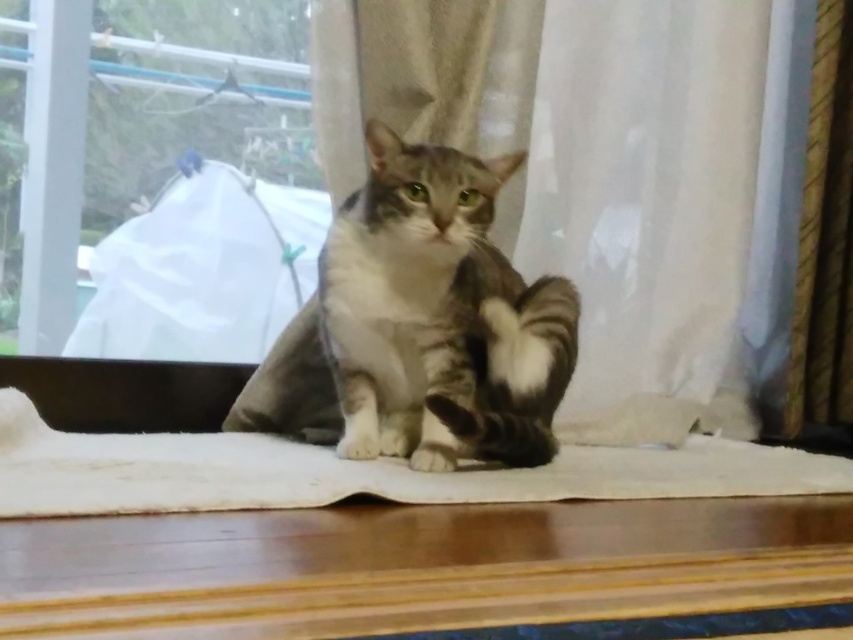
Question: Can you confirm if transparent plastic bag at left is thinner than white fabric mat at center?

Choices:
 (A) no
 (B) yes

Answer: (B)

Question: Which point appears closest to the camera in this image?

Choices:
 (A) (357, 378)
 (B) (45, 486)
 (C) (229, 136)
 (D) (682, 204)

Answer: (B)

Question: Among these objects, which one is farthest from the camera?

Choices:
 (A) gray tabby cat at center
 (B) silky white curtain at center
 (C) transparent plastic bag at left

Answer: (C)

Question: Does silky white curtain at center have a smaller size compared to gray tabby cat at center?

Choices:
 (A) yes
 (B) no

Answer: (B)

Question: Among these points, which one is farthest from the camera?

Choices:
 (A) (515, 173)
 (B) (180, 278)
 (C) (386, 200)

Answer: (B)

Question: Considering the relative positions of transparent plastic bag at left and white fabric mat at center in the image provided, where is transparent plastic bag at left located with respect to white fabric mat at center?

Choices:
 (A) below
 (B) above

Answer: (B)